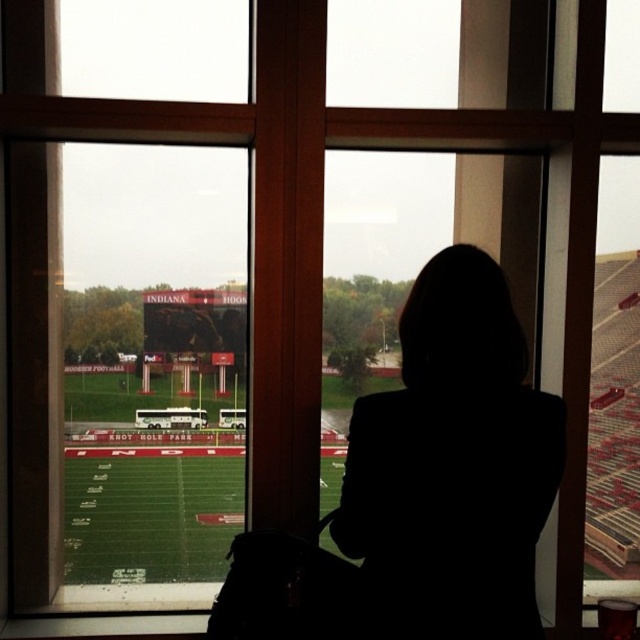
Question: Is green glass window at center bigger than silhouette jacket at center?

Choices:
 (A) yes
 (B) no

Answer: (A)

Question: Is green glass window at center positioned in front of silhouette jacket at center?

Choices:
 (A) no
 (B) yes

Answer: (A)

Question: Which point is closer to the camera?

Choices:
 (A) green glass window at center
 (B) silhouette jacket at center

Answer: (B)

Question: Can you confirm if green glass window at center is smaller than silhouette jacket at center?

Choices:
 (A) yes
 (B) no

Answer: (B)

Question: Among these objects, which one is farthest from the camera?

Choices:
 (A) silhouette jacket at center
 (B) green glass window at center

Answer: (B)